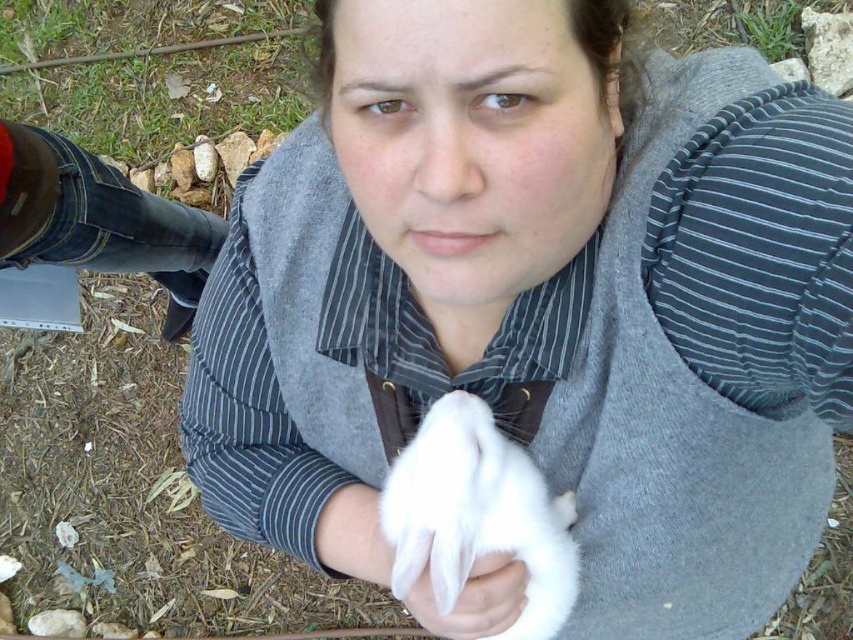
You are standing in the garden and see two points marked in the image. Which point, point (498, 532) or point (393, 561), is nearer to you?

Point (498, 532) is closer to the viewer than point (393, 561).

You are a photographer trying to capture a closeup of the white soft fur at center and the white soft cloth at center in the image. Given that your camera can only focus on objects within a 5 cm range, will both items be in focus?

The white soft fur at center and white soft cloth at center are 4.70 centimeters apart from each other, so yes, both items will be within the 5 cm focus range and thus in focus.

You are trying to determine which item is closer to the right side of the image between the white soft fur at center and the white soft cloth at center. Which one is positioned more to the right?

The white soft fur at center is positioned to the right of the white soft cloth at center, so the white soft fur at center is more to the right.